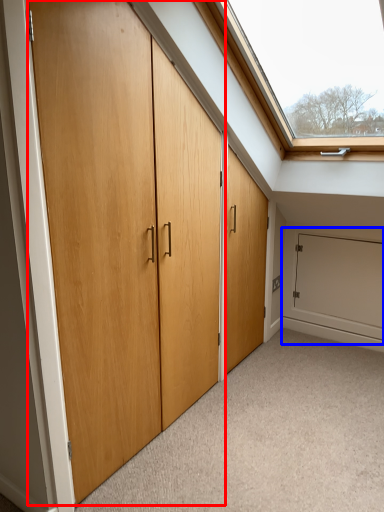
Question: Which object appears closest to the camera in this image, door (highlighted by a red box) or garage door (highlighted by a blue box)?

Choices:
 (A) door
 (B) garage door

Answer: (A)